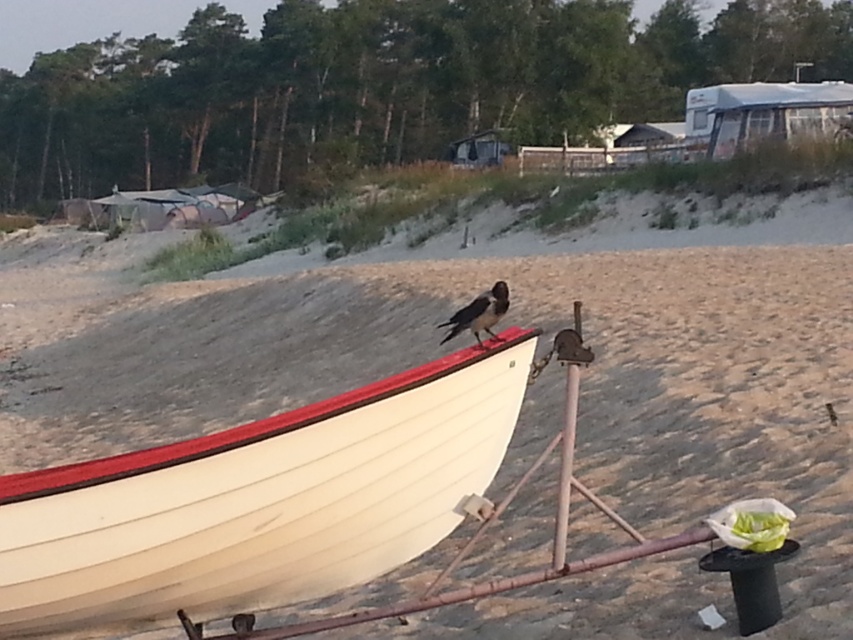
Question: Which point appears farthest from the camera in this image?

Choices:
 (A) (467, 355)
 (B) (486, 328)

Answer: (B)

Question: Which object is closer to the camera taking this photo?

Choices:
 (A) black glossy bird at center
 (B) white wood boat at center

Answer: (B)

Question: Which point is farther to the camera?

Choices:
 (A) (396, 524)
 (B) (456, 323)

Answer: (B)

Question: Does white wood boat at center appear over black glossy bird at center?

Choices:
 (A) yes
 (B) no

Answer: (B)

Question: In this image, where is white wood boat at center located relative to black glossy bird at center?

Choices:
 (A) above
 (B) below

Answer: (B)

Question: Considering the relative positions of white wood boat at center and black glossy bird at center in the image provided, where is white wood boat at center located with respect to black glossy bird at center?

Choices:
 (A) left
 (B) right

Answer: (A)